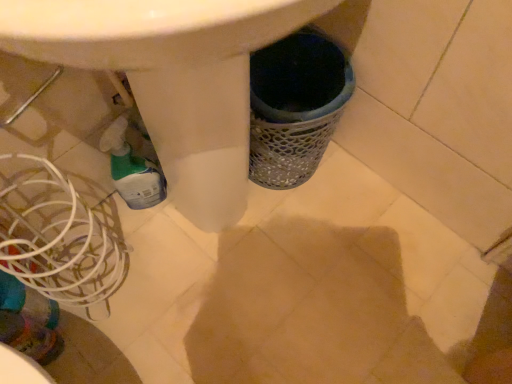
Question: Can you confirm if white wire basket at lower left is shorter than translucent plastic bottle at lower left?

Choices:
 (A) no
 (B) yes

Answer: (A)

Question: Is white wire basket at lower left behind translucent plastic bottle at lower left?

Choices:
 (A) no
 (B) yes

Answer: (A)

Question: Is white wire basket at lower left to the right of translucent plastic bottle at lower left from the viewer's perspective?

Choices:
 (A) no
 (B) yes

Answer: (A)

Question: From the image's perspective, is white wire basket at lower left above translucent plastic bottle at lower left?

Choices:
 (A) yes
 (B) no

Answer: (B)

Question: Considering the relative sizes of white wire basket at lower left and translucent plastic bottle at lower left in the image provided, is white wire basket at lower left taller than translucent plastic bottle at lower left?

Choices:
 (A) no
 (B) yes

Answer: (B)

Question: Does white wire basket at lower left have a smaller size compared to translucent plastic bottle at lower left?

Choices:
 (A) no
 (B) yes

Answer: (A)

Question: Considering the relative sizes of translucent plastic bottle at lower left and white wire basket at lower left in the image provided, is translucent plastic bottle at lower left thinner than white wire basket at lower left?

Choices:
 (A) yes
 (B) no

Answer: (A)

Question: Is white wire basket at lower left at the back of translucent plastic bottle at lower left?

Choices:
 (A) no
 (B) yes

Answer: (A)

Question: Does translucent plastic bottle at lower left have a smaller size compared to white wire basket at lower left?

Choices:
 (A) no
 (B) yes

Answer: (B)

Question: Can you confirm if translucent plastic bottle at lower left is taller than white wire basket at lower left?

Choices:
 (A) no
 (B) yes

Answer: (A)

Question: Would you consider translucent plastic bottle at lower left to be distant from white wire basket at lower left?

Choices:
 (A) no
 (B) yes

Answer: (A)

Question: Is white wire basket at lower left completely or partially inside translucent plastic bottle at lower left?

Choices:
 (A) no
 (B) yes

Answer: (A)

Question: Is white wire basket at lower left wider or thinner than translucent plastic bottle at lower left?

Choices:
 (A) thin
 (B) wide

Answer: (B)